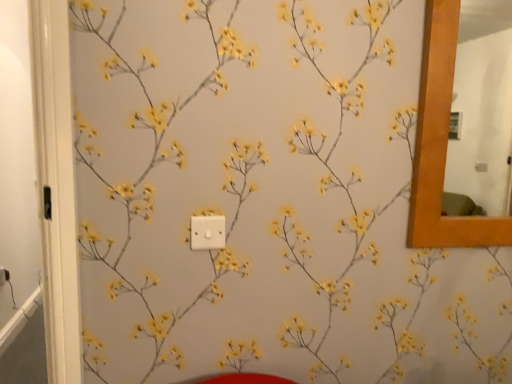
The width and height of the screenshot is (512, 384). What do you see at coordinates (207, 232) in the screenshot?
I see `white plastic light switch at center` at bounding box center [207, 232].

You are a GUI agent. You are given a task and a screenshot of the screen. Output one action in this format:
    pyautogui.click(x=<x>, y=<y>)
    Task: Click on the white plastic light switch at center
    The image size is (512, 384).
    Given the screenshot: What is the action you would take?
    pyautogui.click(x=207, y=232)

The height and width of the screenshot is (384, 512). Find the location of `white plastic light switch at center`. white plastic light switch at center is located at coordinates click(207, 232).